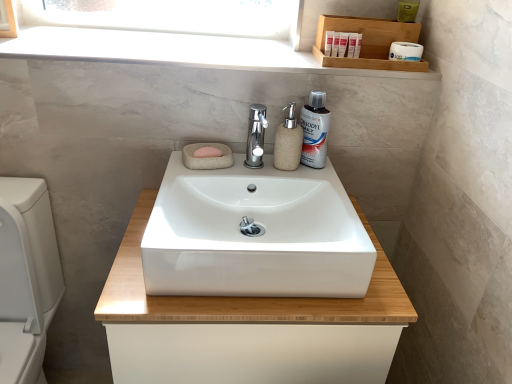
Question: Should I look upward or downward to see white glossy sink at center?

Choices:
 (A) down
 (B) up

Answer: (B)

Question: Can you confirm if wooden tray at upper right is thinner than beige stone soap dispenser at center?

Choices:
 (A) no
 (B) yes

Answer: (A)

Question: Is wooden tray at upper right wider than beige stone soap dispenser at center?

Choices:
 (A) yes
 (B) no

Answer: (A)

Question: Considering the relative sizes of wooden tray at upper right and beige stone soap dispenser at center in the image provided, is wooden tray at upper right bigger than beige stone soap dispenser at center?

Choices:
 (A) yes
 (B) no

Answer: (A)

Question: Considering the relative positions of wooden tray at upper right and beige stone soap dispenser at center in the image provided, is wooden tray at upper right to the left of beige stone soap dispenser at center from the viewer's perspective?

Choices:
 (A) yes
 (B) no

Answer: (B)

Question: Considering the relative positions of wooden tray at upper right and beige stone soap dispenser at center in the image provided, is wooden tray at upper right to the right of beige stone soap dispenser at center from the viewer's perspective?

Choices:
 (A) no
 (B) yes

Answer: (B)

Question: Is wooden tray at upper right closer to camera compared to beige stone soap dispenser at center?

Choices:
 (A) no
 (B) yes

Answer: (A)

Question: Considering the relative sizes of pink stone soap at center and white marble window sill at upper center in the image provided, is pink stone soap at center thinner than white marble window sill at upper center?

Choices:
 (A) yes
 (B) no

Answer: (A)

Question: From a real-world perspective, is pink stone soap at center physically above white marble window sill at upper center?

Choices:
 (A) no
 (B) yes

Answer: (A)

Question: Considering the relative sizes of pink stone soap at center and white marble window sill at upper center in the image provided, is pink stone soap at center taller than white marble window sill at upper center?

Choices:
 (A) no
 (B) yes

Answer: (B)

Question: Does pink stone soap at center lie in front of white marble window sill at upper center?

Choices:
 (A) no
 (B) yes

Answer: (A)

Question: Is pink stone soap at center facing towards white marble window sill at upper center?

Choices:
 (A) yes
 (B) no

Answer: (B)

Question: Considering the relative sizes of pink stone soap at center and white marble window sill at upper center in the image provided, is pink stone soap at center shorter than white marble window sill at upper center?

Choices:
 (A) no
 (B) yes

Answer: (A)

Question: Can white glossy mouthwash at upper right be found inside white glossy toilet at lower left?

Choices:
 (A) yes
 (B) no

Answer: (B)